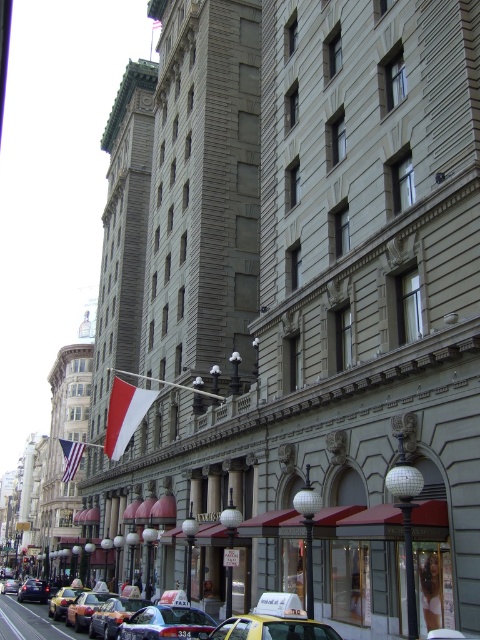
Question: Which point is farther to the camera?

Choices:
 (A) (47, 593)
 (B) (183, 612)
 (C) (113, 384)

Answer: (A)

Question: Is yellow plastic taxi at center smaller than metallic taxi cab at center?

Choices:
 (A) no
 (B) yes

Answer: (B)

Question: Which of these objects is positioned closest to the matte gray building at left?

Choices:
 (A) yellow matte taxi at lower center
 (B) yellow metallic taxi at center
 (C) metallic silver taxi cab at center

Answer: (C)

Question: Is american flag at center closer to the viewer compared to metallic silver taxi at center?

Choices:
 (A) yes
 (B) no

Answer: (B)

Question: In this image, where is matte gray building at left located relative to yellow matte taxi at lower center?

Choices:
 (A) above
 (B) below

Answer: (B)

Question: Which object appears farthest from the camera in this image?

Choices:
 (A) metallic silver taxi at center
 (B) yellow matte taxi at lower center

Answer: (A)